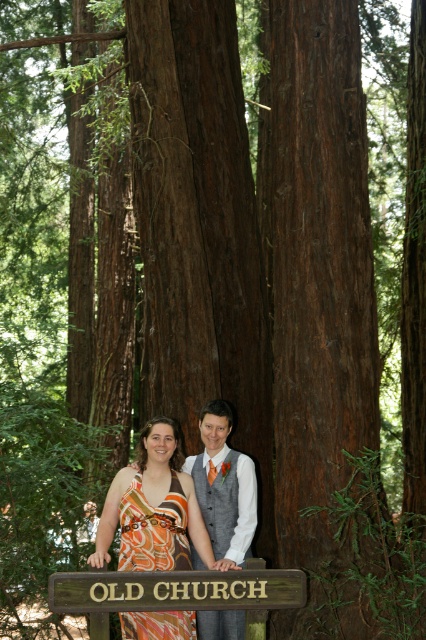
You are a photographer planning to take a portrait of the two people in the scene. You want to ensure that the orange printed dress at center and the wooden sign at center are both visible in the frame. Based on their positions, which object should you focus on first to ensure both are in focus?

The wooden sign at center is below the orange printed dress at center, so focusing on the orange printed dress at center first will ensure both are in focus since it is positioned higher up.

You are standing in front of the large ancient tree and want to reach a specific point marked at coordinates point (150, 506). If you are currently 5 meters away from the tree, can you safely walk forward to reach that point without getting too close to the tree?

The distance of point (150, 506) from viewer is 5.89 meters. Since you are currently 5 meters away from the tree, moving forward to reach the point would bring you closer to the tree, but the point is 5.89 meters away from your current position, so you can safely walk forward to reach it without getting too close to the tree.